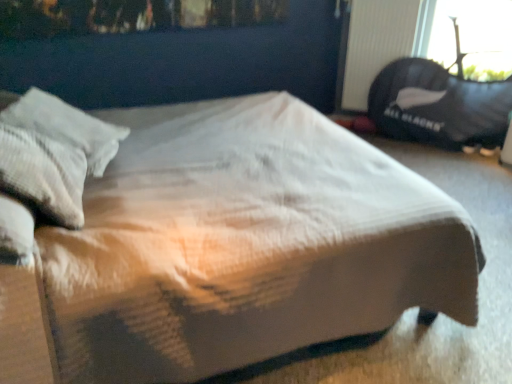
Question: Is black plastic radiator at upper right outside white quilted fabric bed at center?

Choices:
 (A) yes
 (B) no

Answer: (A)

Question: Is white quilted fabric bed at center located within black plastic radiator at upper right?

Choices:
 (A) yes
 (B) no

Answer: (B)

Question: Is black plastic radiator at upper right aimed at white quilted fabric bed at center?

Choices:
 (A) no
 (B) yes

Answer: (B)

Question: Does black plastic radiator at upper right have a larger size compared to white quilted fabric bed at center?

Choices:
 (A) yes
 (B) no

Answer: (B)

Question: Considering the relative positions of black plastic radiator at upper right and white quilted fabric bed at center in the image provided, is black plastic radiator at upper right to the right of white quilted fabric bed at center from the viewer's perspective?

Choices:
 (A) no
 (B) yes

Answer: (B)

Question: In terms of width, does gray textured pillow at left look wider or thinner when compared to black fabric bean bag at upper right?

Choices:
 (A) wide
 (B) thin

Answer: (A)

Question: Relative to black fabric bean bag at upper right, is gray textured pillow at left in front or behind?

Choices:
 (A) front
 (B) behind

Answer: (A)

Question: Is point (94, 170) positioned closer to the camera than point (426, 132)?

Choices:
 (A) closer
 (B) farther

Answer: (A)

Question: Looking at the image, does gray textured pillow at left seem bigger or smaller compared to black fabric bean bag at upper right?

Choices:
 (A) small
 (B) big

Answer: (A)

Question: From the image's perspective, is black plastic radiator at upper right positioned above or below white quilted fabric bed at center?

Choices:
 (A) above
 (B) below

Answer: (A)

Question: Considering the positions of black plastic radiator at upper right and white quilted fabric bed at center in the image, is black plastic radiator at upper right taller or shorter than white quilted fabric bed at center?

Choices:
 (A) short
 (B) tall

Answer: (A)

Question: From a real-world perspective, is black plastic radiator at upper right physically located above or below white quilted fabric bed at center?

Choices:
 (A) below
 (B) above

Answer: (B)

Question: Is black plastic radiator at upper right in front of or behind white quilted fabric bed at center in the image?

Choices:
 (A) behind
 (B) front

Answer: (A)

Question: Is black plastic radiator at upper right wider or thinner than black fabric bean bag at upper right?

Choices:
 (A) thin
 (B) wide

Answer: (A)

Question: Considering the positions of point (398, 51) and point (421, 77), is point (398, 51) closer or farther from the camera than point (421, 77)?

Choices:
 (A) farther
 (B) closer

Answer: (A)